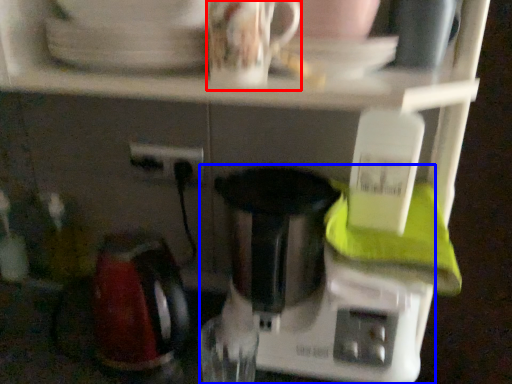
Question: Which point is further to the camera, coffee cup (highlighted by a red box) or mixer (highlighted by a blue box)?

Choices:
 (A) coffee cup
 (B) mixer

Answer: (B)